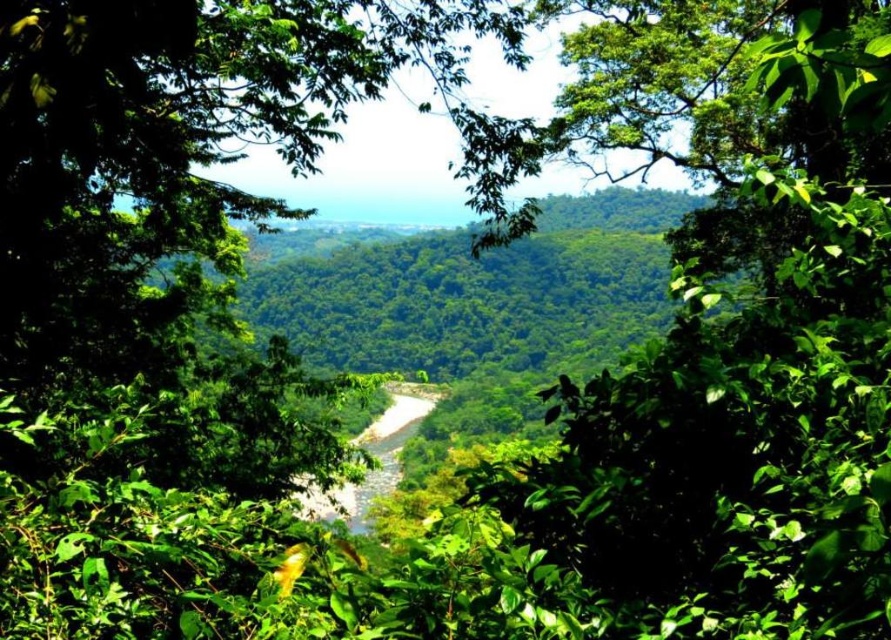
You are an environmental scientist studying the landscape. You observe the green leafy tree at center and the green leafy forest at center. Which of these two has a greater height?

The green leafy tree at center has a greater height compared to the green leafy forest at center.

You are standing in the lush landscape and want to take a photo of the green leafy tree at center and the green leafy forest at center. Which one should you focus on first if you want to capture both in a single frame without moving the camera?

The green leafy tree at center is located below the green leafy forest at center, so you should focus on the green leafy forest at center first to ensure both are in the frame.